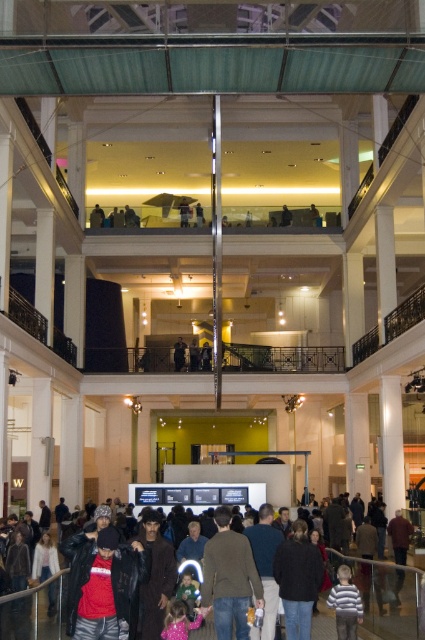
Question: Is dark clothing crowd at center positioned in front of striped sweater at lower right?

Choices:
 (A) yes
 (B) no

Answer: (A)

Question: Considering the real-world distances, which object is farthest from the dark clothing crowd at center?

Choices:
 (A) striped sweater at lower right
 (B) brown wool sweater at center
 (C) dark brown leather jacket at center

Answer: (C)

Question: Among these objects, which one is farthest from the camera?

Choices:
 (A) dark brown leather jacket at center
 (B) brown wool sweater at center
 (C) striped sweater at lower right
 (D) dark clothing crowd at center

Answer: (A)

Question: Does dark clothing crowd at center have a lesser width compared to brown wool sweater at center?

Choices:
 (A) yes
 (B) no

Answer: (B)

Question: Can you confirm if dark clothing crowd at center is positioned to the left of striped sweater at lower right?

Choices:
 (A) no
 (B) yes

Answer: (B)

Question: Which point is farther from the camera taking this photo?

Choices:
 (A) (232, 584)
 (B) (59, 614)

Answer: (B)